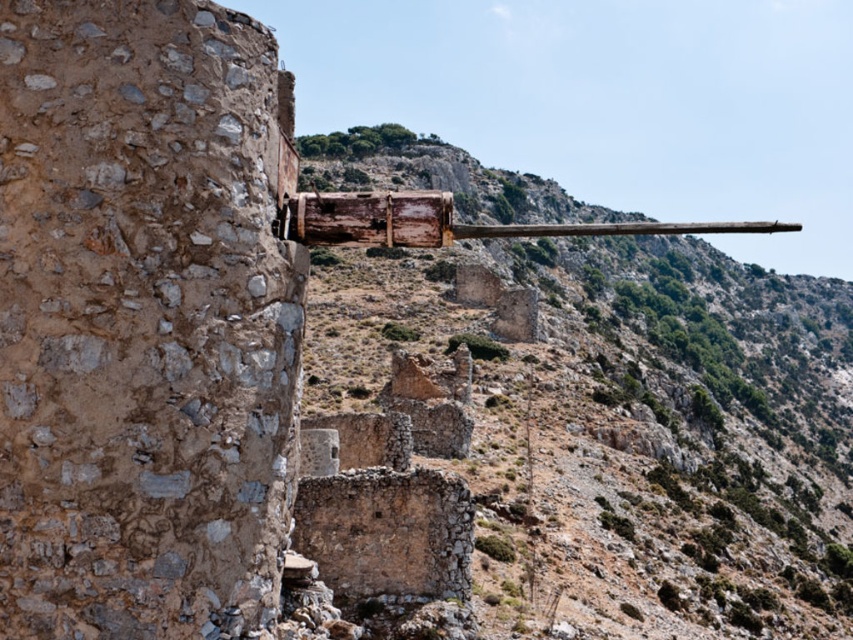
Question: Is rustic stone wall at left in front of rusty wood cannon at center?

Choices:
 (A) yes
 (B) no

Answer: (A)

Question: Which point is farther from the camera taking this photo?

Choices:
 (A) (485, 285)
 (B) (67, 326)

Answer: (A)

Question: Which point is farther from the camera taking this photo?

Choices:
 (A) (465, 332)
 (B) (244, 147)

Answer: (A)

Question: Can you confirm if rustic stone wall at left is bigger than rusty wood cannon at center?

Choices:
 (A) no
 (B) yes

Answer: (A)

Question: Can you confirm if rustic stone wall at left is positioned above rusty wood cannon at center?

Choices:
 (A) yes
 (B) no

Answer: (B)

Question: Which point is closer to the camera?

Choices:
 (A) (16, 99)
 (B) (828, 426)

Answer: (A)